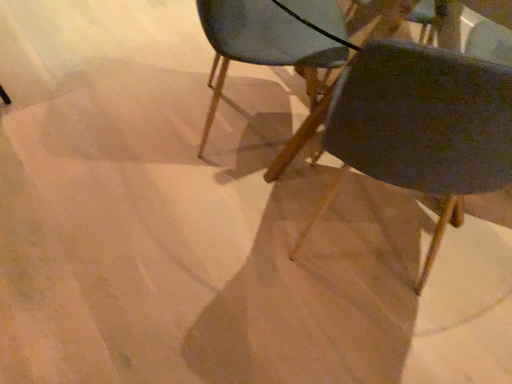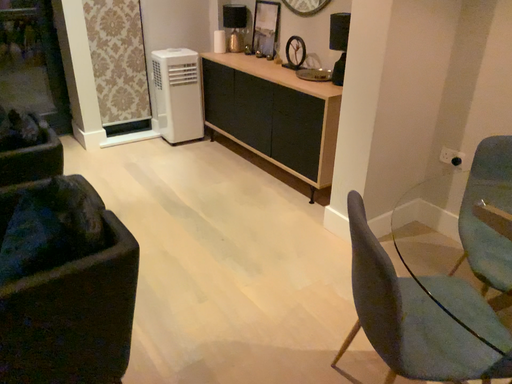
Question: Which way did the camera rotate in the video?

Choices:
 (A) rotated downward
 (B) rotated upward

Answer: (B)